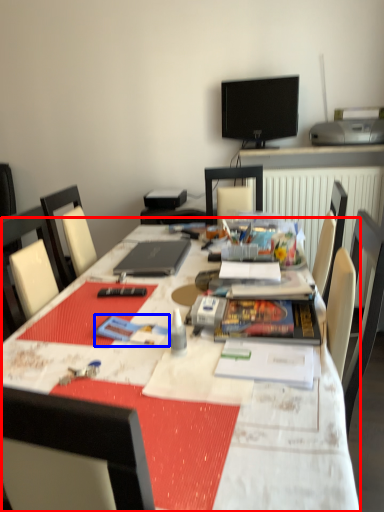
Question: Which point is closer to the camera, table (highlighted by a red box) or paperback book (highlighted by a blue box)?

Choices:
 (A) table
 (B) paperback book

Answer: (A)